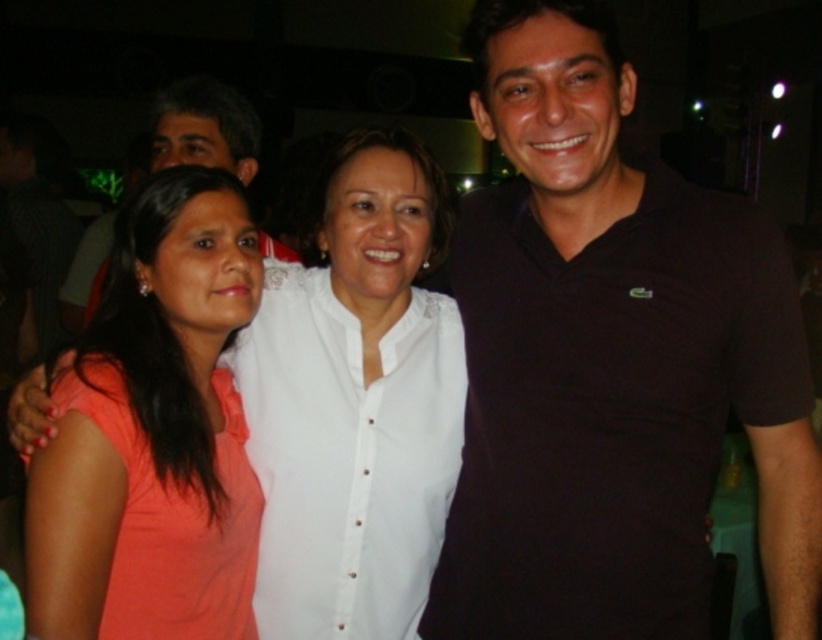
Which of these two, white button-up shirt at center or matte black polo shirt at center, stands taller?

With more height is white button-up shirt at center.

Between point (343, 493) and point (239, 150), which one is positioned in front?

Positioned in front is point (343, 493).

Who is more distant from viewer, (284, 342) or (178, 108)?

The point (178, 108) is behind.

This screenshot has height=640, width=822. Identify the location of white button-up shirt at center. (347, 456).

In the scene shown: Who is positioned more to the right, black cotton polo shirt at right or matte black polo shirt at center?

black cotton polo shirt at right

Does black cotton polo shirt at right have a greater height compared to matte black polo shirt at center?

Yes, black cotton polo shirt at right is taller than matte black polo shirt at center.

Is point (492, 60) closer to viewer compared to point (261, 132)?

Yes, point (492, 60) is in front of point (261, 132).

Identify the location of black cotton polo shirt at right. (610, 362).

Is point (403, 573) closer to viewer compared to point (419, 548)?

That is True.

Which is above, matte orange shirt at center or white button-up shirt at center?

Positioned higher is matte orange shirt at center.

Between point (351, 532) and point (377, 419), which one is positioned in front?

Point (351, 532) is in front.

Where is `matte orange shirt at center`? The height and width of the screenshot is (640, 822). matte orange shirt at center is located at coordinates (356, 400).